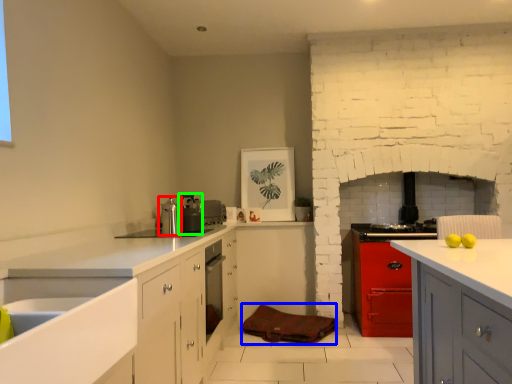
Question: Based on their relative distances, which object is nearer to kitchen appliance (highlighted by a red box)? Choose from material (highlighted by a blue box) and appliance (highlighted by a green box).

Choices:
 (A) material
 (B) appliance

Answer: (B)